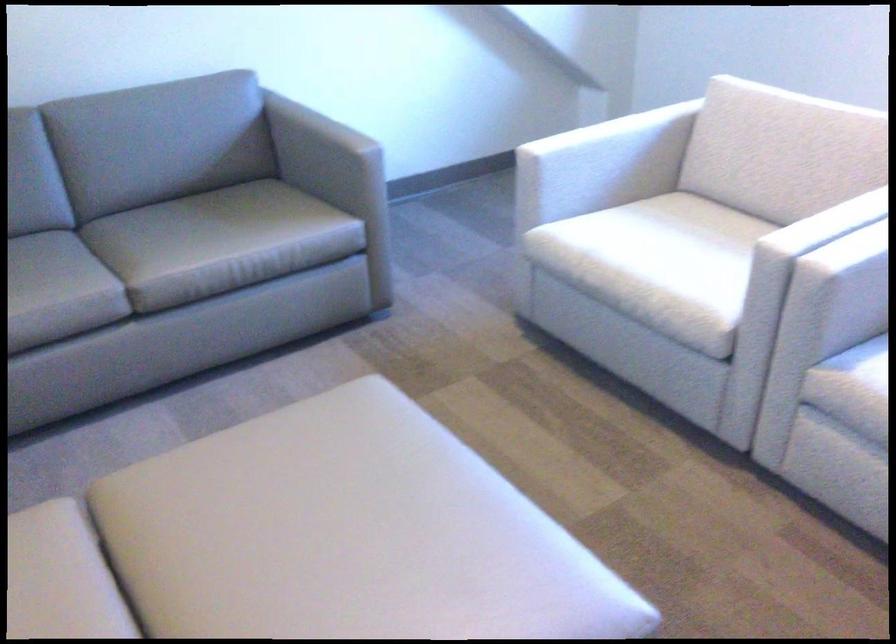
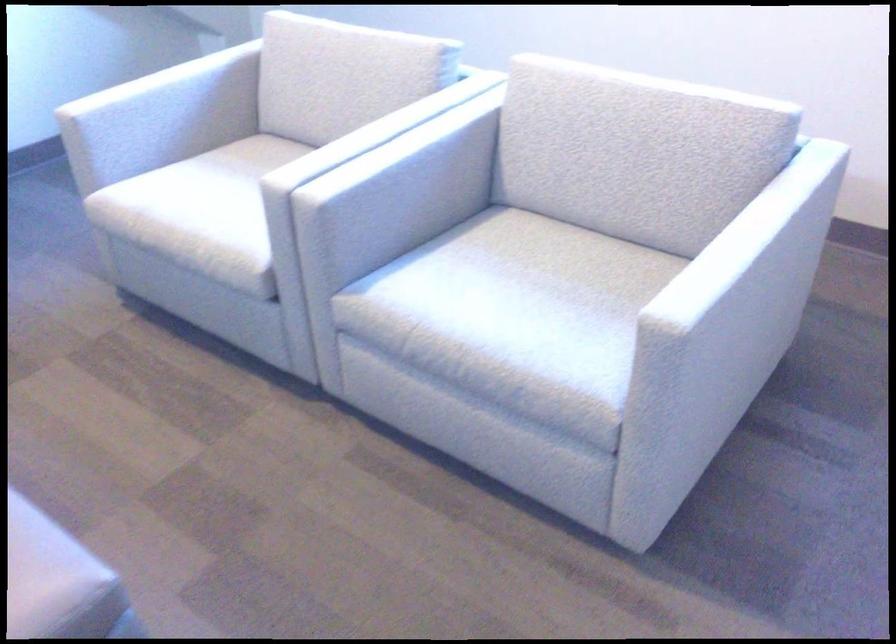
Question: Which direction would the cameraman need to move to produce the second image? Reply with the corresponding letter.

Choices:
 (A) Left
 (B) Right
 (C) Forward
 (D) Backward

Answer: (B)